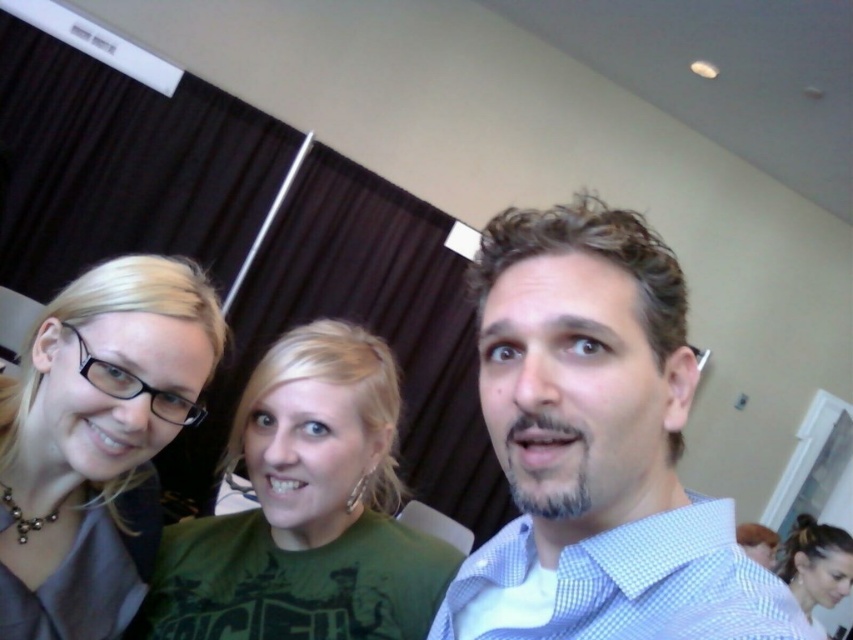
Question: Can you confirm if matte black glasses at left is positioned to the left of dark brown hair at lower right?

Choices:
 (A) yes
 (B) no

Answer: (A)

Question: Estimate the real-world distances between objects in this image. Which object is farther from the light blue checkered shirt at center?

Choices:
 (A) green fabric shirt at center
 (B) matte black glasses at left

Answer: (B)

Question: Which object is positioned closest to the dark brown hair at lower right?

Choices:
 (A) light blue checkered shirt at center
 (B) green fabric shirt at center
 (C) matte black glasses at left

Answer: (B)

Question: Does matte black glasses at left appear on the left side of dark brown hair at lower right?

Choices:
 (A) no
 (B) yes

Answer: (B)

Question: Which of these objects is positioned farthest from the light blue checkered shirt at center?

Choices:
 (A) green fabric shirt at center
 (B) matte black glasses at left

Answer: (B)

Question: Observing the image, what is the correct spatial positioning of green fabric shirt at center in reference to dark brown hair at lower right?

Choices:
 (A) above
 (B) below

Answer: (A)